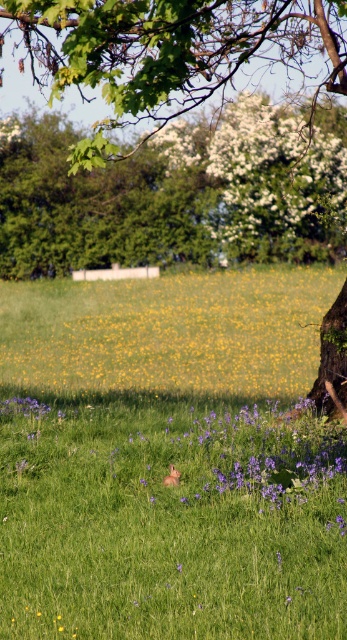
Is brown furry rabbit at center to the right of white matte flower at upper center from the viewer's perspective?

In fact, brown furry rabbit at center is to the left of white matte flower at upper center.

Which is in front, point (311, 548) or point (230, 259)?

Point (311, 548) is more forward.

Locate an element on the screen. This screenshot has height=640, width=347. brown furry rabbit at center is located at coordinates [171, 522].

Does brown furry rabbit at center have a lesser height compared to yellow matte flower at center?

Indeed, brown furry rabbit at center has a lesser height compared to yellow matte flower at center.

Is brown furry rabbit at center to the left of yellow matte flower at center from the viewer's perspective?

Incorrect, brown furry rabbit at center is not on the left side of yellow matte flower at center.

You are a GUI agent. You are given a task and a screenshot of the screen. Output one action in this format:
    pyautogui.click(x=<x>, y=<y>)
    Task: Click on the brown furry rabbit at center
    This screenshot has width=347, height=640.
    Given the screenshot: What is the action you would take?
    pyautogui.click(x=171, y=522)

Can you confirm if brown textured tree at center right is positioned to the left of white matte flower at upper center?

Correct, you'll find brown textured tree at center right to the left of white matte flower at upper center.

Does point (235, 10) come behind point (184, 124)?

That is False.

Is point (77, 61) in front of point (263, 99)?

That is True.

Locate an element on the screen. This screenshot has height=640, width=347. brown textured tree at center right is located at coordinates (168, 52).